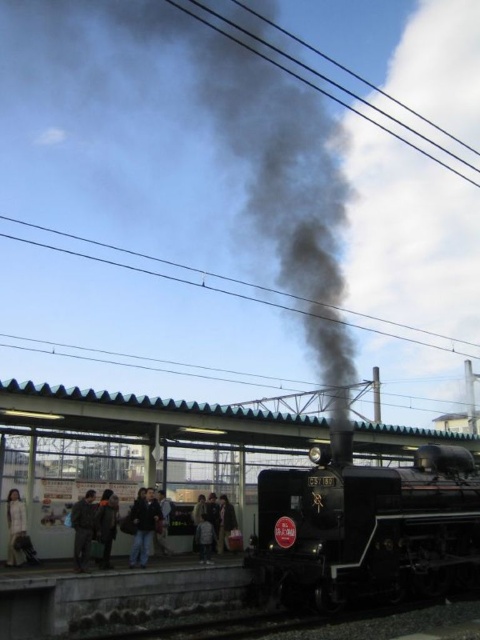
Can you confirm if black metal train at center is smaller than light gray fabric jacket at center?

Actually, black metal train at center might be larger than light gray fabric jacket at center.

Is point (70, 625) positioned before point (199, 554)?

Yes, point (70, 625) is in front of point (199, 554).

You are a GUI agent. You are given a task and a screenshot of the screen. Output one action in this format:
    pyautogui.click(x=<x>, y=<y>)
    Task: Click on the black metal train at center
    
    Given the screenshot: What is the action you would take?
    pyautogui.click(x=290, y=547)

The image size is (480, 640). In order to click on light beige jacket at center in this screenshot , I will do `click(50, 538)`.

Does light beige jacket at center have a lesser height compared to dark gray jacket at lower left?

Indeed, light beige jacket at center has a lesser height compared to dark gray jacket at lower left.

What do you see at coordinates (50, 538) in the screenshot? I see `light beige jacket at center` at bounding box center [50, 538].

You are a GUI agent. You are given a task and a screenshot of the screen. Output one action in this format:
    pyautogui.click(x=<x>, y=<y>)
    Task: Click on the light beige jacket at center
    The image size is (480, 640).
    Given the screenshot: What is the action you would take?
    pyautogui.click(x=50, y=538)

Who is positioned more to the left, light beige jacket at center or dark gray fabric jacket at lower center?

light beige jacket at center is more to the left.

Can you confirm if light beige jacket at center is wider than dark gray fabric jacket at lower center?

No.

This screenshot has height=640, width=480. What do you see at coordinates (50, 538) in the screenshot?
I see `light beige jacket at center` at bounding box center [50, 538].

Where is `light beige jacket at center`? This screenshot has width=480, height=640. light beige jacket at center is located at coordinates (50, 538).